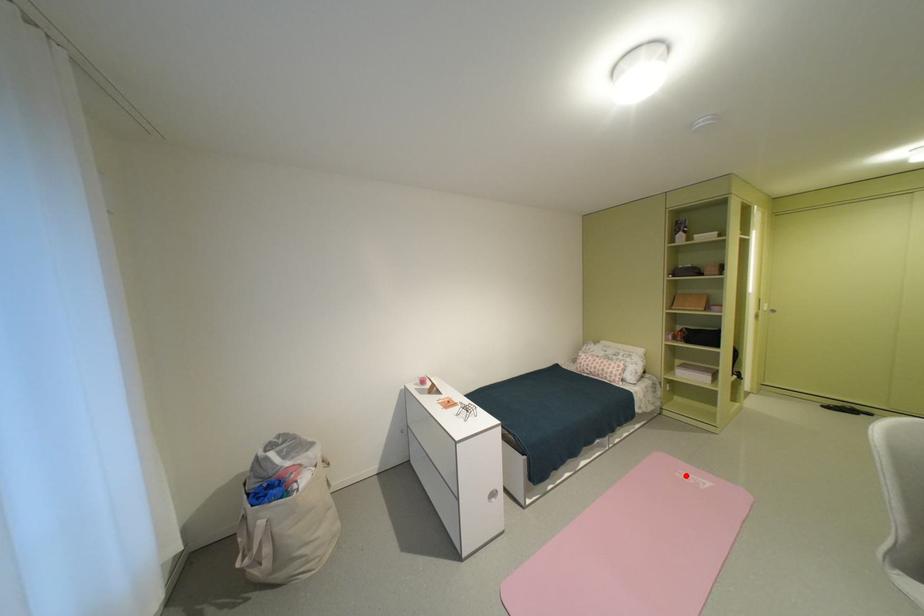
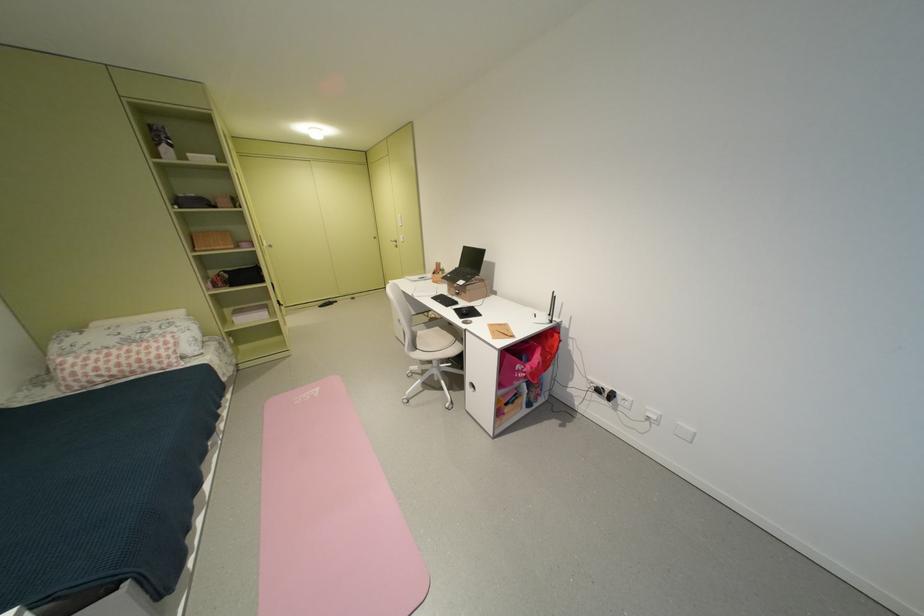
Locate, in the second image, the point that corresponds to the highlighted location in the first image.

(305, 403)